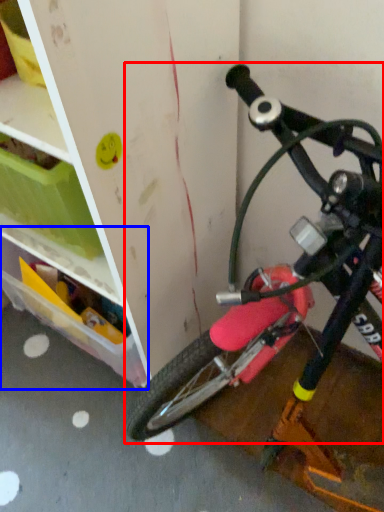
Question: Which object appears farthest to the camera in this image, bicycle (highlighted by a red box) or storage box (highlighted by a blue box)?

Choices:
 (A) bicycle
 (B) storage box

Answer: (B)